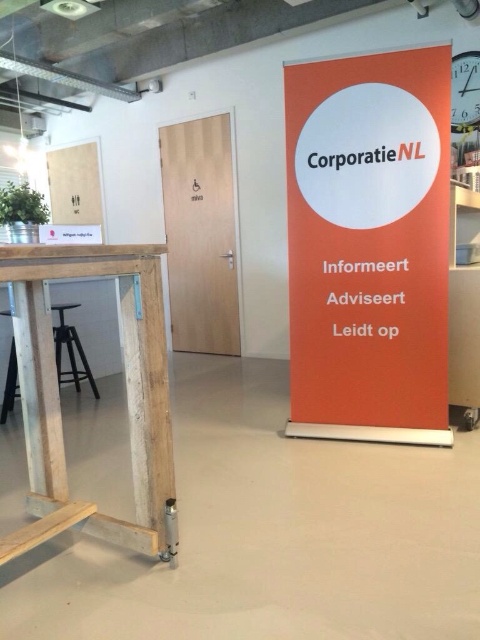
Can you confirm if orange matte sign at right is positioned to the right of wooden table at left?

Correct, you'll find orange matte sign at right to the right of wooden table at left.

Can you confirm if orange matte sign at right is wider than wooden table at left?

Yes.

Find the location of a particular element. This screenshot has width=480, height=640. orange matte sign at right is located at coordinates (369, 244).

Between point (48, 154) and point (56, 352), which one is positioned behind?

The point (48, 154) is behind.

From the picture: Who is more forward, (50, 202) or (6, 416)?

Point (6, 416) is more forward.

Between point (56, 163) and point (79, 387), which one is positioned in front?

Point (79, 387)

Where is `white matte paper at upper left`? white matte paper at upper left is located at coordinates (74, 184).

Is wooden table at left positioned before white matte paper at upper left?

That is True.

Who is lower down, wooden table at left or white matte paper at upper left?

wooden table at left is below.

This screenshot has height=640, width=480. What do you see at coordinates (126, 394) in the screenshot? I see `wooden table at left` at bounding box center [126, 394].

Locate an element on the screen. The width and height of the screenshot is (480, 640). wooden table at left is located at coordinates (126, 394).